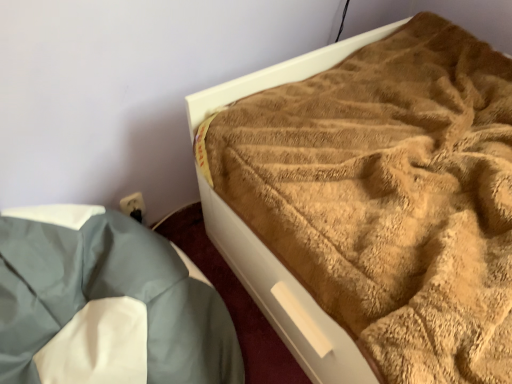
Question: Is brown fuzzy blanket at upper right in front of or behind light blue fabric at lower left in the image?

Choices:
 (A) behind
 (B) front

Answer: (A)

Question: Would you say brown fuzzy blanket at upper right is to the left or to the right of light blue fabric at lower left in the picture?

Choices:
 (A) right
 (B) left

Answer: (A)

Question: From a real-world perspective, relative to light blue fabric at lower left, is brown fuzzy blanket at upper right vertically above or below?

Choices:
 (A) above
 (B) below

Answer: (A)

Question: Would you say light blue fabric at lower left is inside or outside brown fuzzy blanket at upper right?

Choices:
 (A) outside
 (B) inside

Answer: (A)

Question: Is point (189, 264) closer or farther from the camera than point (330, 203)?

Choices:
 (A) farther
 (B) closer

Answer: (A)

Question: Based on their sizes in the image, would you say light blue fabric at lower left is bigger or smaller than brown fuzzy blanket at upper right?

Choices:
 (A) big
 (B) small

Answer: (B)

Question: From the image's perspective, is light blue fabric at lower left located above or below brown fuzzy blanket at upper right?

Choices:
 (A) above
 (B) below

Answer: (B)